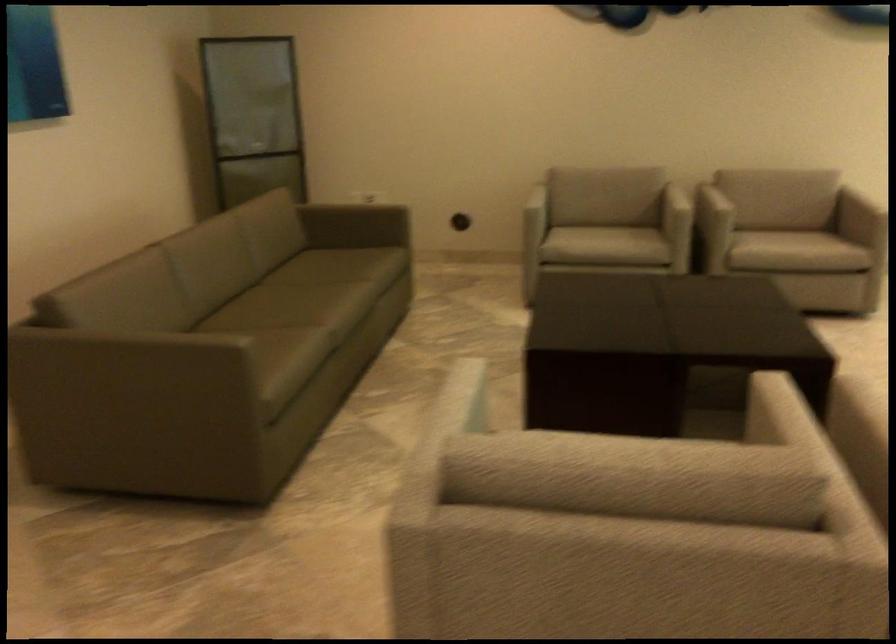
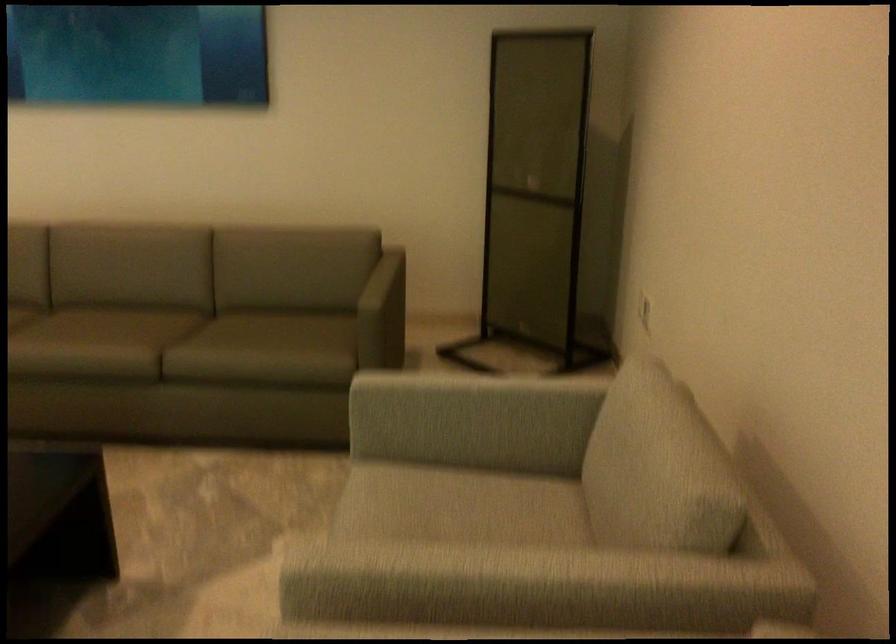
The point at (615, 167) is marked in the first image. Where is the corresponding point in the second image?

(653, 451)